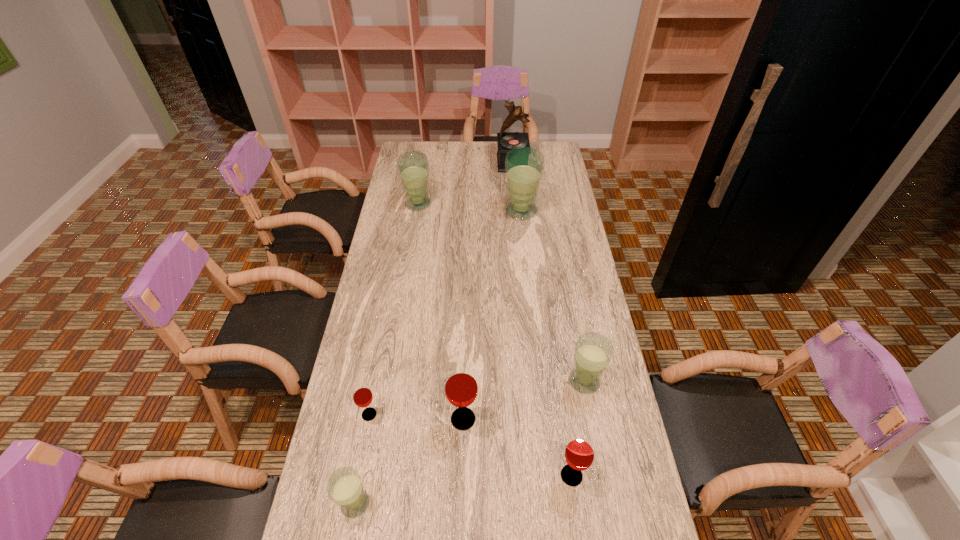
Locate an element on the screen. This screenshot has width=960, height=540. the leftmost red glass is located at coordinates (362, 395).

Where is `the smallest blue glass`? This screenshot has height=540, width=960. the smallest blue glass is located at coordinates (345, 487).

In order to click on free location located at the horn opening of the farthest object in this screenshot , I will do `click(437, 163)`.

I want to click on free space located 0.050m at the horn opening of the farthest object, so click(x=487, y=163).

Find the location of `vacant space located 0.230m at the horn opening of the farthest object`. vacant space located 0.230m at the horn opening of the farthest object is located at coordinates [451, 163].

I want to click on free space located 0.100m on the right of the third blue glass from left to right, so (562, 211).

Identify the location of vacant space located 0.070m on the back of the third smallest blue glass. The image size is (960, 540). (420, 186).

Where is `blank area located 0.260m on the back of the fourth object from left to right`? blank area located 0.260m on the back of the fourth object from left to right is located at coordinates (466, 333).

The width and height of the screenshot is (960, 540). In order to click on free space located on the back of the second biggest red glass in this screenshot , I will do pos(564,426).

Identify the location of vacant region located on the back of the third biggest blue glass. The width and height of the screenshot is (960, 540). (572, 314).